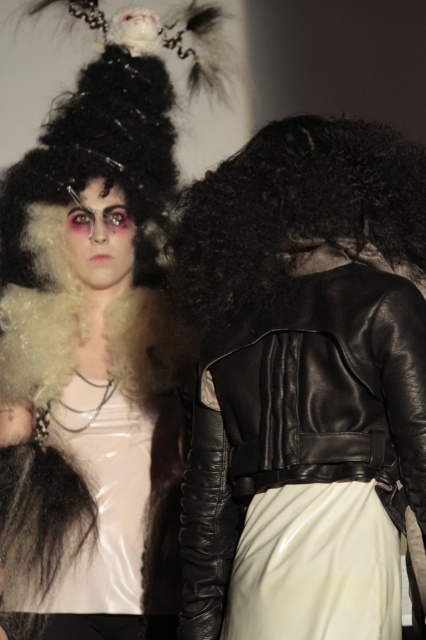
Question: Can you confirm if black curly wig at back is positioned below white glossy dress at center?

Choices:
 (A) no
 (B) yes

Answer: (A)

Question: In this image, where is black curly wig at back located relative to white glossy dress at center?

Choices:
 (A) left
 (B) right

Answer: (B)

Question: Which point is closer to the camera?

Choices:
 (A) (397, 134)
 (B) (141, 499)

Answer: (A)

Question: Which point is closer to the camera taking this photo?

Choices:
 (A) (111, 410)
 (B) (342, 116)

Answer: (B)

Question: Does black curly wig at back lie behind white glossy dress at center?

Choices:
 (A) yes
 (B) no

Answer: (B)